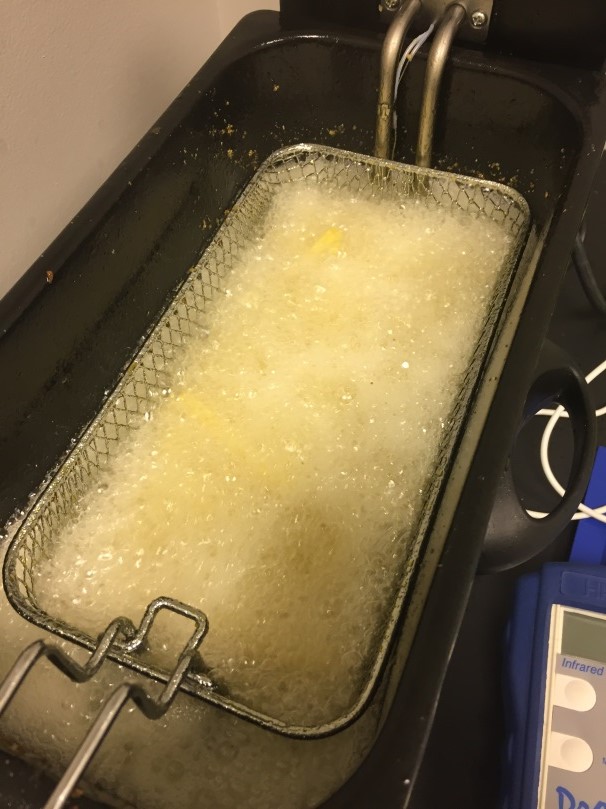
Where is `cable`? cable is located at coordinates (553, 428).